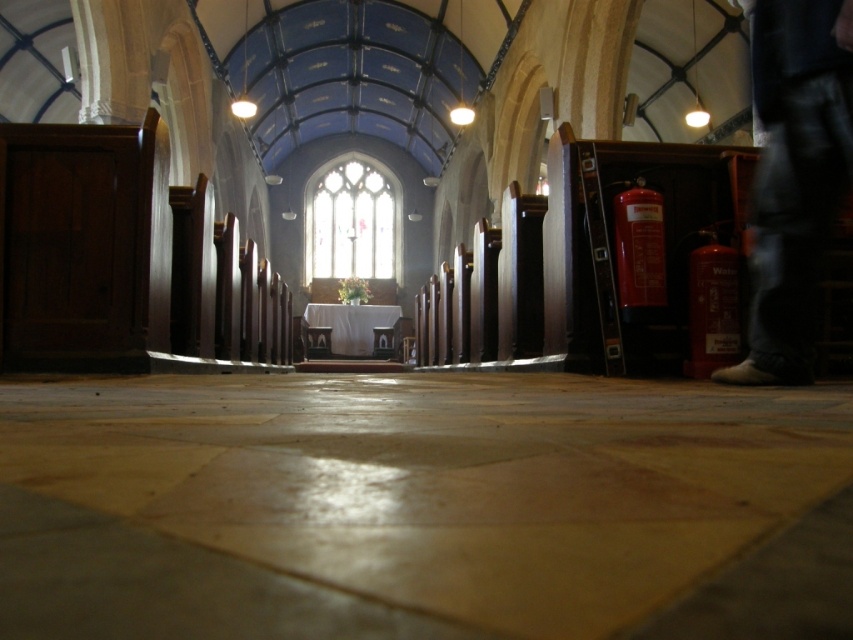
Question: Does smooth stone aisle at center have a lesser width compared to jeans at right?

Choices:
 (A) yes
 (B) no

Answer: (B)

Question: Is smooth stone aisle at center above jeans at right?

Choices:
 (A) yes
 (B) no

Answer: (B)

Question: Among these points, which one is nearest to the camera?

Choices:
 (A) (294, 470)
 (B) (769, 323)

Answer: (A)

Question: Does smooth stone aisle at center lie behind jeans at right?

Choices:
 (A) yes
 (B) no

Answer: (B)